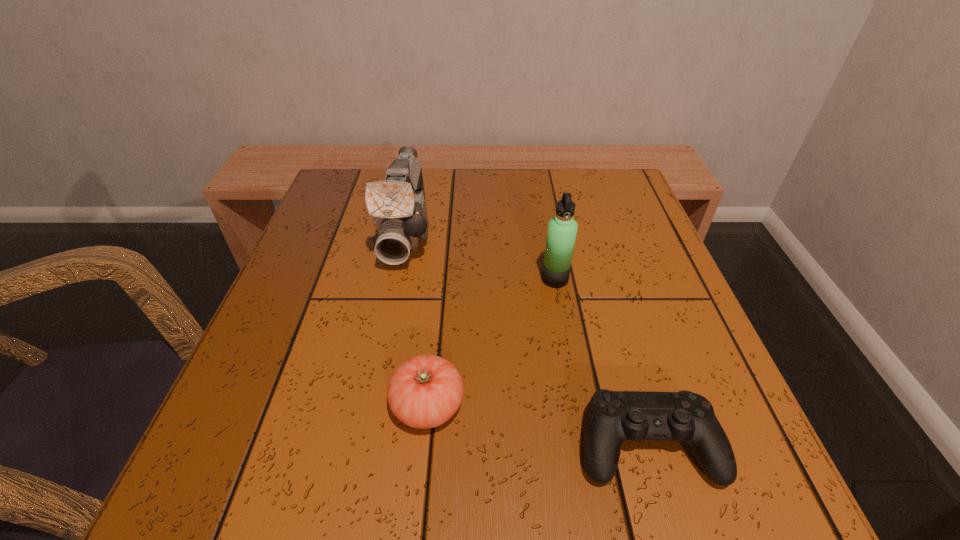
Image resolution: width=960 pixels, height=540 pixels. Identify the location of object present at the left edge. (397, 204).

Locate an element on the screen. Image resolution: width=960 pixels, height=540 pixels. object that is at the right edge is located at coordinates (613, 417).

Locate an element on the screen. This screenshot has width=960, height=540. object that is at the far left corner is located at coordinates (397, 204).

In order to click on object at the near right corner in this screenshot , I will do `click(613, 417)`.

What are the coordinates of `free space at the far edge` in the screenshot? It's located at (540, 182).

The width and height of the screenshot is (960, 540). What are the coordinates of `free space at the near edge` in the screenshot? It's located at (571, 447).

The height and width of the screenshot is (540, 960). Identify the location of vacant space at the left edge. (326, 396).

At what (x,y) coordinates should I click in order to perform the action: click on free spot at the right edge of the desktop. Please return your answer as a coordinate pair (x, y). Looking at the image, I should click on tap(665, 387).

In the image, there is a desktop. Identify the location of free space at the far right corner. The image size is (960, 540). (612, 204).

Locate an element on the screen. Image resolution: width=960 pixels, height=540 pixels. vacant region at the near right corner of the desktop is located at coordinates point(684,482).